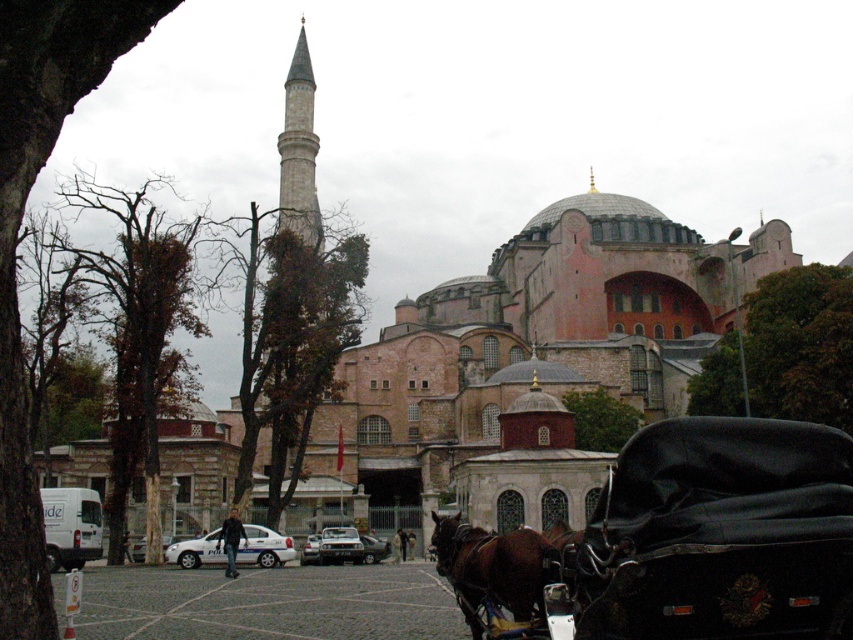
Question: Which object is positioned farthest from the black leather horse cart at center?

Choices:
 (A) black leather coach at center
 (B) brown glossy horse at lower center

Answer: (A)

Question: Which of the following is the closest to the observer?

Choices:
 (A) black leather coach at center
 (B) brown glossy horse at lower center

Answer: (B)

Question: Does brown glossy horse at lower center have a greater width compared to black leather coach at center?

Choices:
 (A) no
 (B) yes

Answer: (B)

Question: In this image, where is brown glossy horse at lower center located relative to black leather coach at center?

Choices:
 (A) left
 (B) right

Answer: (B)

Question: Estimate the real-world distances between objects in this image. Which object is closer to the black leather coach at center?

Choices:
 (A) black leather horse cart at center
 (B) brown glossy horse at lower center

Answer: (B)

Question: Does brown glossy horse at lower center lie behind black leather coach at center?

Choices:
 (A) no
 (B) yes

Answer: (A)